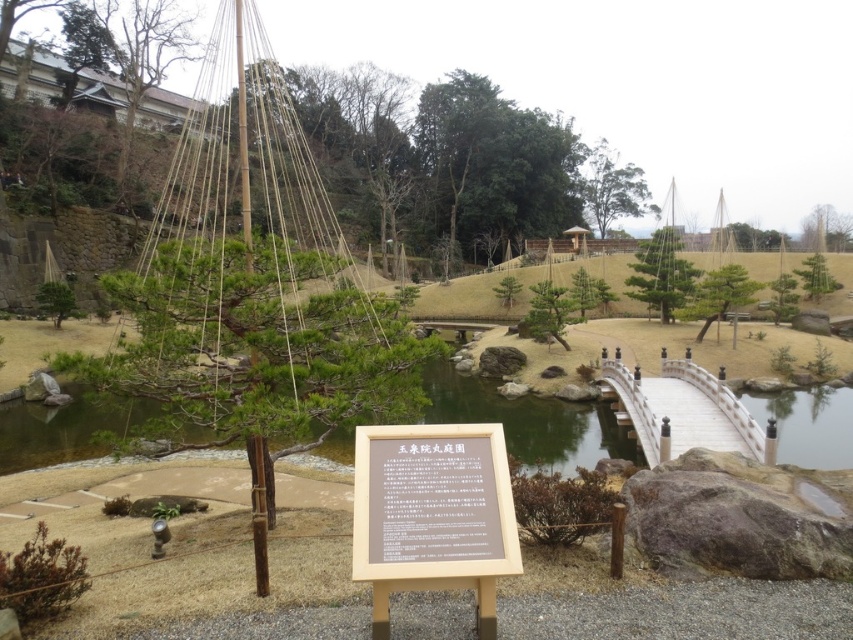
Question: Estimate the real-world distances between objects in this image. Which object is closer to the green stone pond at center?

Choices:
 (A) brown wooden sign at center
 (B) white wooden bridge at center

Answer: (B)

Question: Can you confirm if green stone pond at center is positioned below brown wooden sign at center?

Choices:
 (A) yes
 (B) no

Answer: (A)

Question: Can you confirm if brown wooden sign at center is wider than white wooden bridge at center?

Choices:
 (A) no
 (B) yes

Answer: (A)

Question: Is brown wooden sign at center thinner than white wooden bridge at center?

Choices:
 (A) no
 (B) yes

Answer: (B)

Question: Considering the real-world distances, which object is closest to the brown wooden sign at center?

Choices:
 (A) white wooden bridge at center
 (B) green stone pond at center

Answer: (B)

Question: Which object is closer to the camera taking this photo?

Choices:
 (A) white wooden bridge at center
 (B) green stone pond at center

Answer: (B)